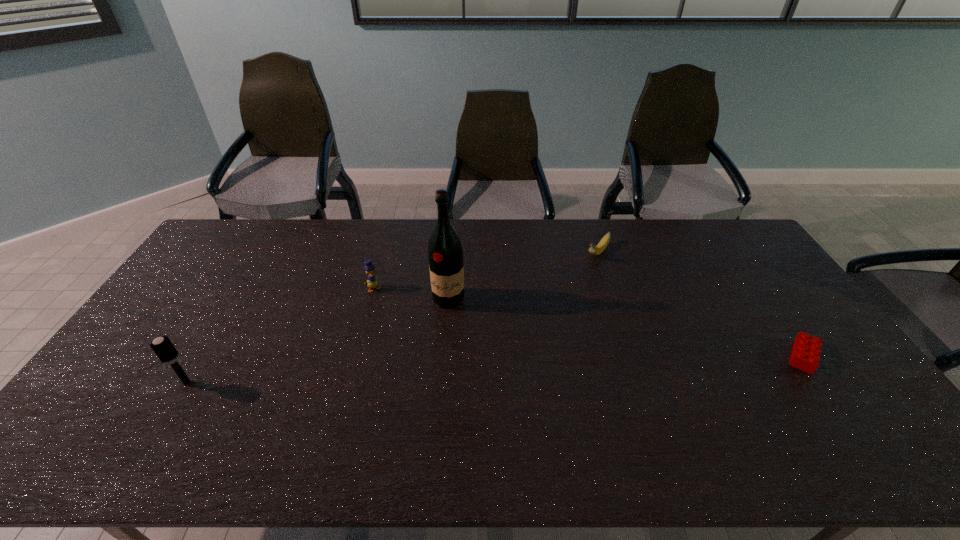
The width and height of the screenshot is (960, 540). I want to click on vacant space in between the duckling and the shortest object, so click(588, 322).

Locate an element on the screen. The height and width of the screenshot is (540, 960). empty space between the hairbrush and the fourth object from right to left is located at coordinates (280, 336).

This screenshot has height=540, width=960. I want to click on unoccupied position between the banana and the third object from right to left, so click(x=523, y=276).

The height and width of the screenshot is (540, 960). I want to click on vacant area that lies between the rightmost object and the third object from right to left, so [626, 327].

Locate an element on the screen. Image resolution: width=960 pixels, height=540 pixels. vacant space that is in between the rightmost object and the fourth tallest object is located at coordinates (701, 305).

Where is `unoccupied area between the rightmost object and the hairbrush`? The width and height of the screenshot is (960, 540). unoccupied area between the rightmost object and the hairbrush is located at coordinates (495, 369).

Image resolution: width=960 pixels, height=540 pixels. What are the coordinates of `unoccupied position between the second shortest object and the Lego` in the screenshot? It's located at pyautogui.click(x=701, y=305).

You are a GUI agent. You are given a task and a screenshot of the screen. Output one action in this format:
    pyautogui.click(x=<x>, y=<y>)
    Task: Click on the object that can be found as the second closest to the rightmost object
    The width and height of the screenshot is (960, 540).
    Given the screenshot: What is the action you would take?
    pyautogui.click(x=445, y=254)

Locate which object is the fourth closest to the farthest object. Please provide its 2D coordinates. Your answer should be formatted as a tuple, i.e. [(x, y)], where the tuple contains the x and y coordinates of a point satisfying the conditions above.

[(164, 349)]